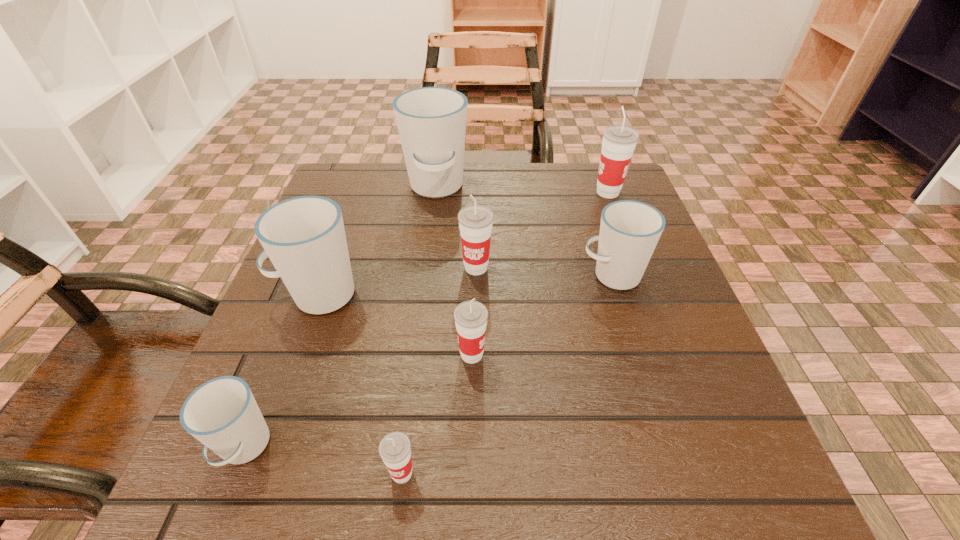
At what (x,y) coordinates should I click in order to perform the action: click on vacant area located with a handle on the side of the third biggest white cup. Please return your answer as a coordinate pair (x, y). Looking at the image, I should click on (380, 275).

At what (x,y) coordinates should I click in order to perform the action: click on object located in the near left corner section of the desktop. Please return your answer as a coordinate pair (x, y). Looking at the image, I should click on (222, 413).

The width and height of the screenshot is (960, 540). Find the location of `object that is at the far right corner`. object that is at the far right corner is located at coordinates (619, 141).

I want to click on vacant position at the left edge of the desktop, so click(x=372, y=258).

The width and height of the screenshot is (960, 540). Identify the location of blank area at the right edge. (671, 366).

Image resolution: width=960 pixels, height=540 pixels. In the image, there is a desktop. Identify the location of vacant space at the far left corner. click(x=387, y=195).

In the image, there is a desktop. Where is `vacant space at the near right corner`? vacant space at the near right corner is located at coordinates (645, 458).

Find the location of a particular element. Image resolution: width=960 pixels, height=540 pixels. free space between the nearest red cup and the second white cup from right to left is located at coordinates (420, 330).

Identify the location of empty location between the second farthest red cup and the biggest white cup. (456, 228).

I want to click on free area in between the third smallest white cup and the third smallest red cup, so click(x=397, y=281).